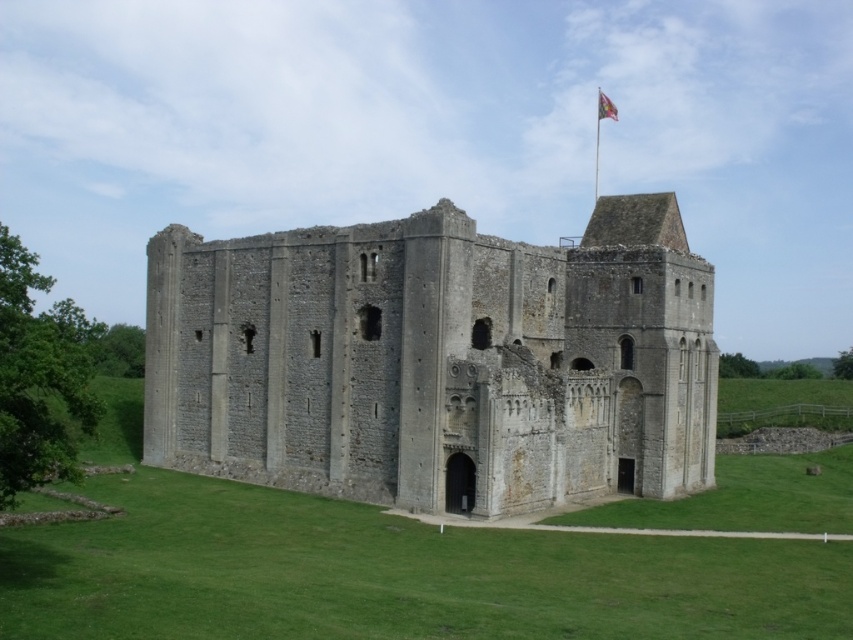
Is the position of gray stone castle at center less distant than that of silky fabric flag at upper right?

Yes, it is.

Does gray stone castle at center appear over silky fabric flag at upper right?

No.

The image size is (853, 640). I want to click on gray stone castle at center, so click(x=437, y=360).